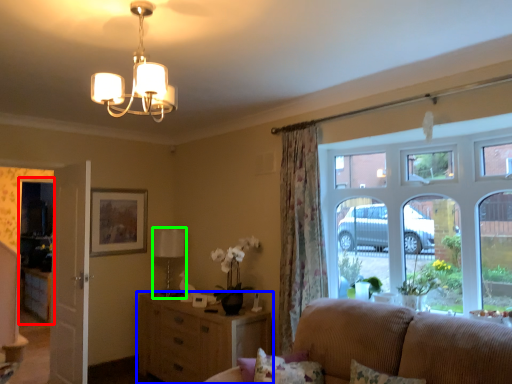
Question: Estimate the real-world distances between objects in this image. Which object is farther from glass door (highlighted by a red box), cabinetry (highlighted by a blue box) or lamp (highlighted by a green box)?

Choices:
 (A) cabinetry
 (B) lamp

Answer: (A)